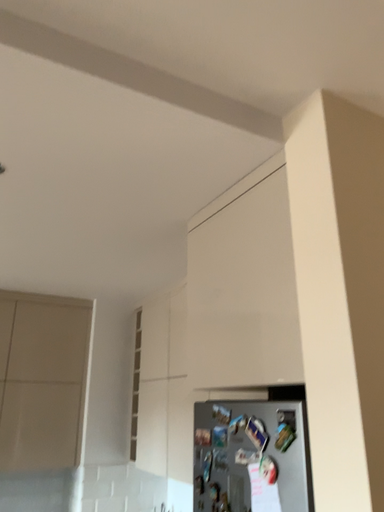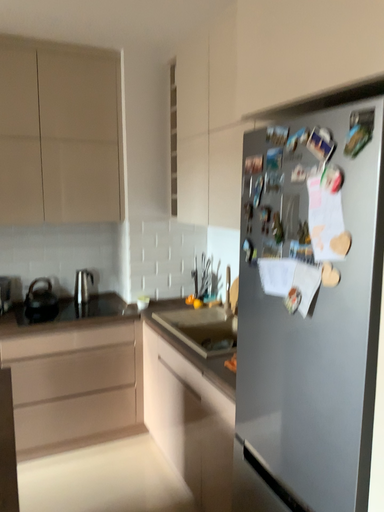
Question: How did the camera likely rotate when shooting the video?

Choices:
 (A) rotated downward
 (B) rotated upward

Answer: (A)